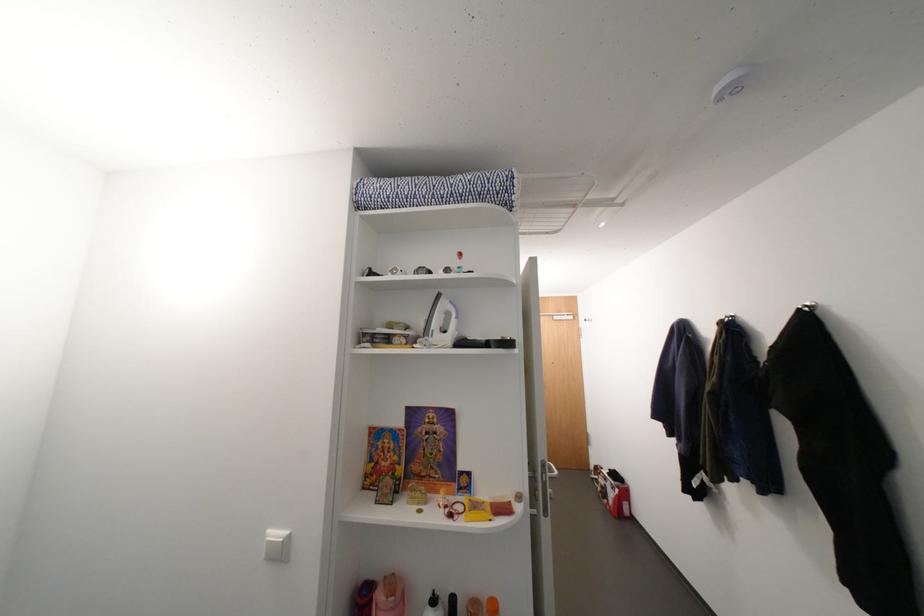
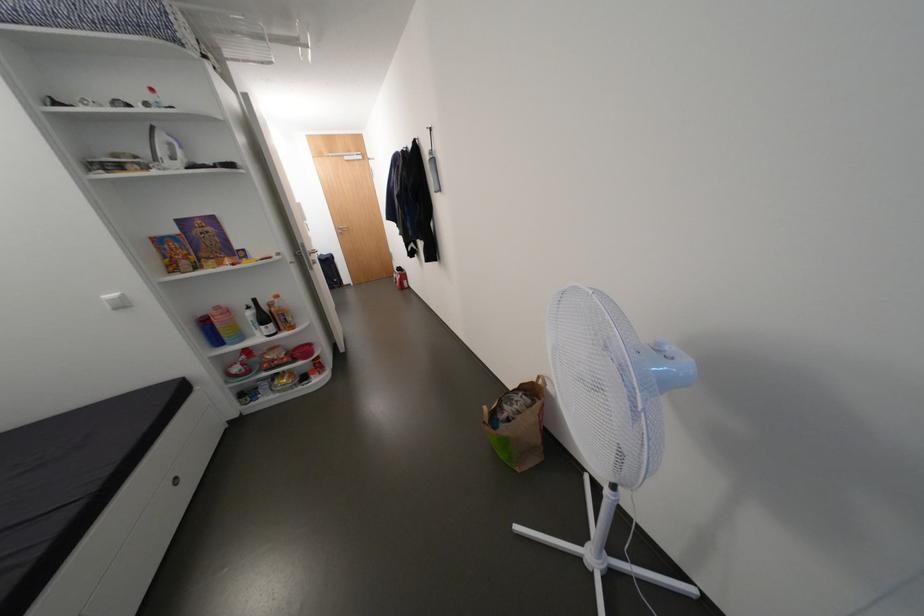
In the second image, find the point that corresponds to the point at 286,536 in the first image.

(120, 296)